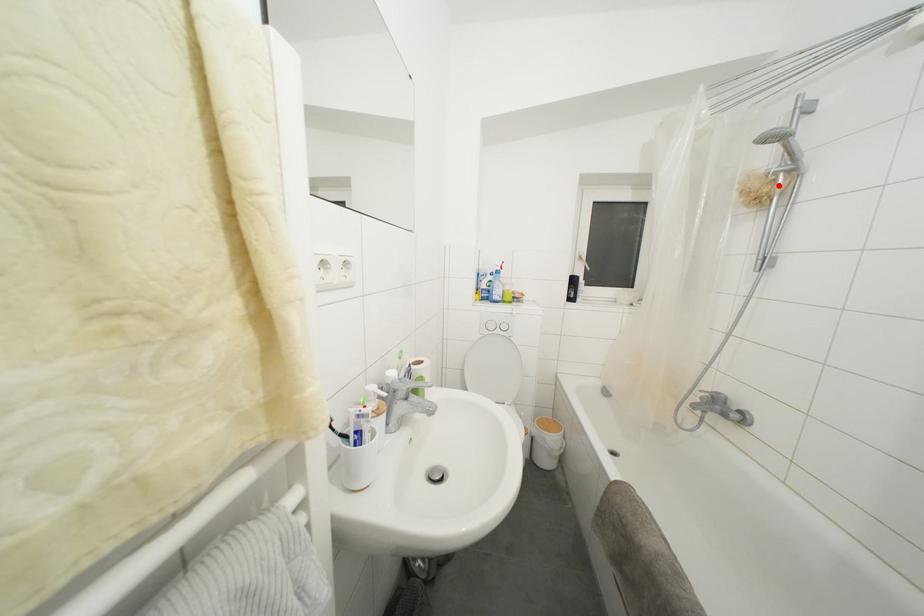
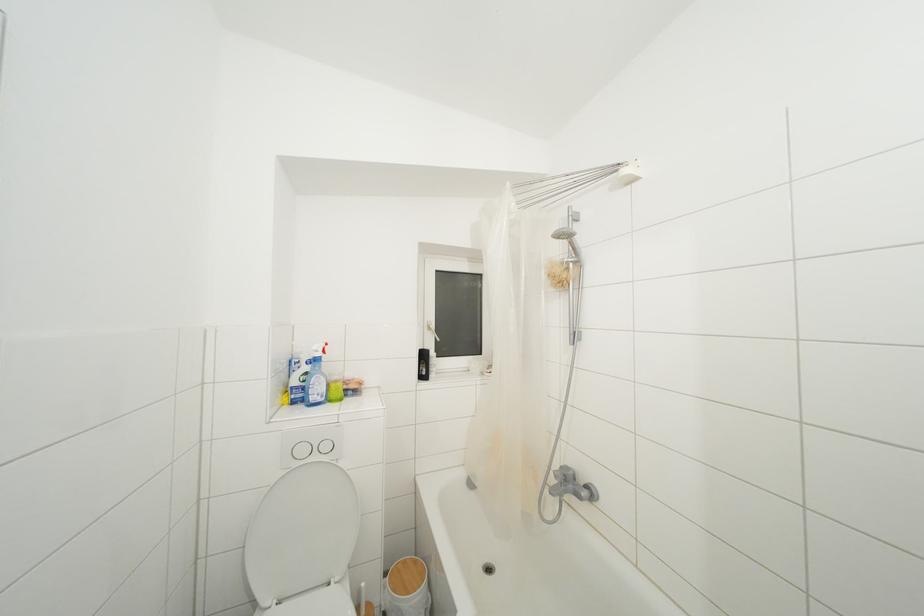
Find the pixel in the second image that matches the highlighted location in the first image.

(572, 273)